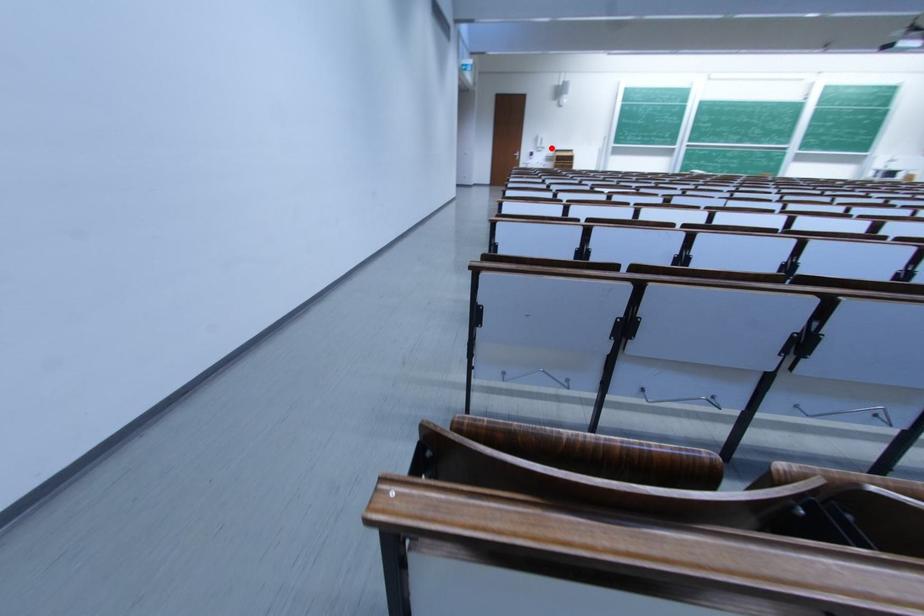
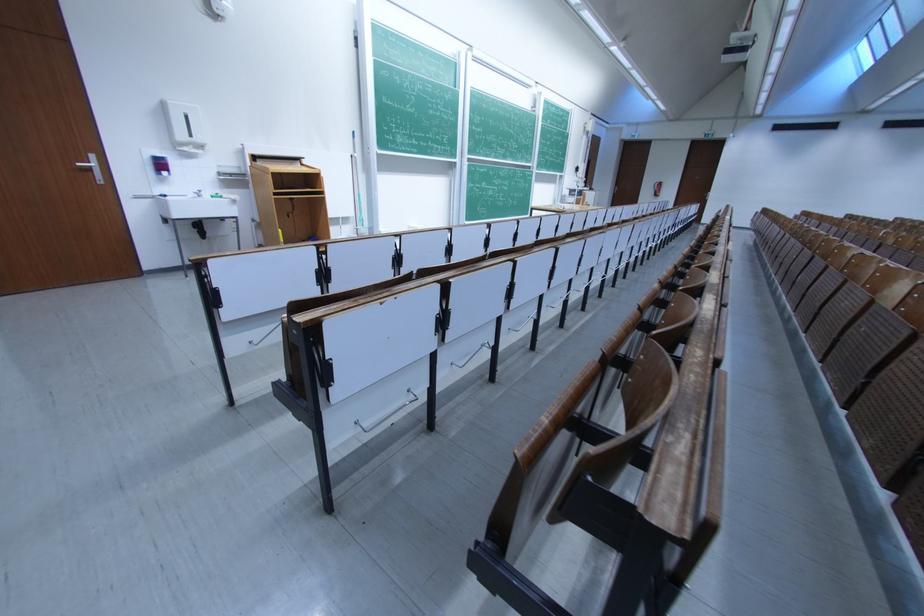
The point at the highlighted location is marked in the first image. Where is the corresponding point in the second image?

(205, 142)